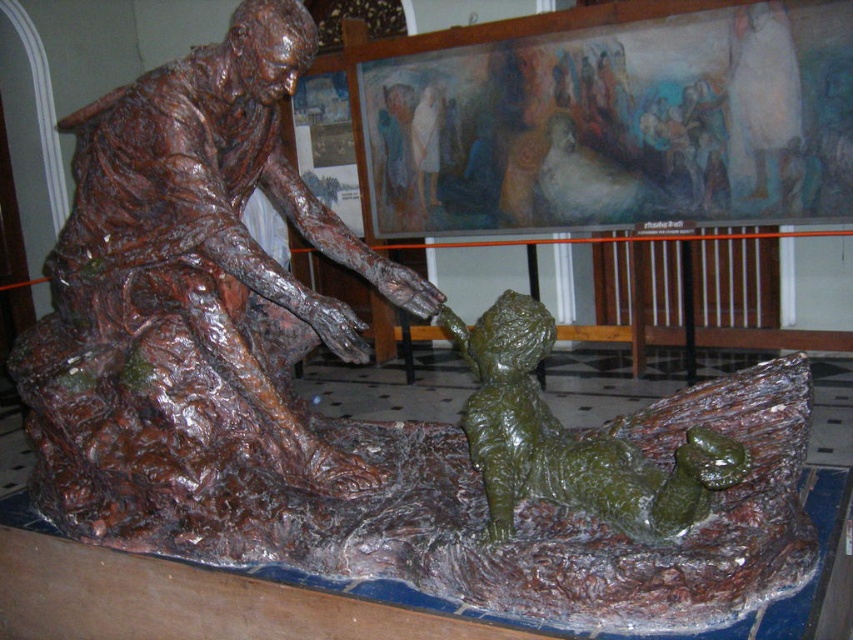
You are an art conservator examining the sculpture and the mural in the background. You notice two points marked on the image at coordinates point (82, 184) and point (679, 492). From the perspective of someone standing directly in front of the sculpture, which point is closer to the viewer?

Point (679, 492) is closer to the viewer because it is in front of point (82, 184).

You are an art conservator assessing the space between two central figures in the image. The bronze statue at center and the green wax boy at center are both in the central area. Which one has a greater width?

The bronze statue at center has a greater width than the green wax boy at center.

You are standing in front of the bronze sculpture and want to place a small flower bouquet at point (332, 228). If your arm reaches 3.5 meters, can you reach that point?

The distance of point (332, 228) from camera is 3.95 meters, so you cannot reach it with an arm that extends only 3.5 meters.